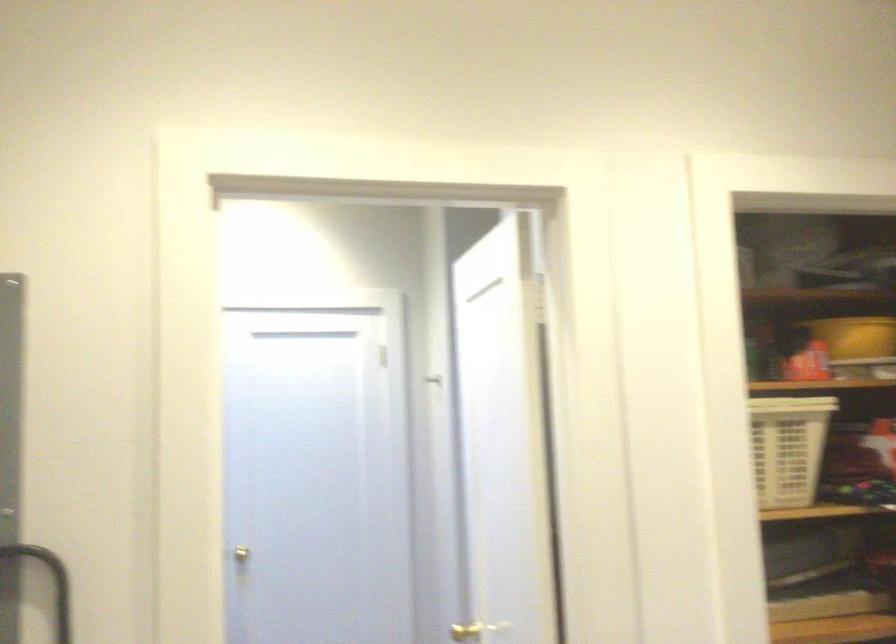
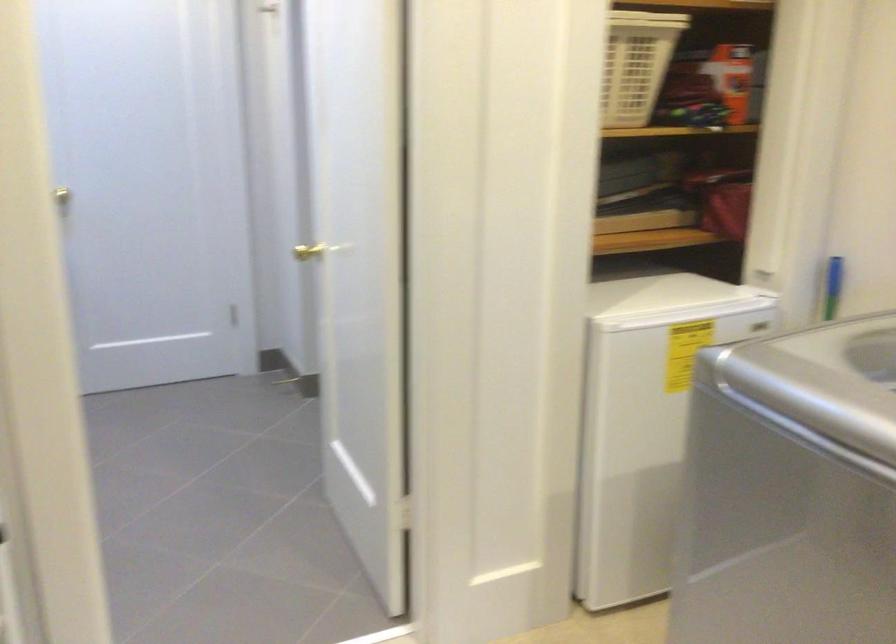
Where in the second image is the point corresponding to pixel 244 556 from the first image?

(71, 192)